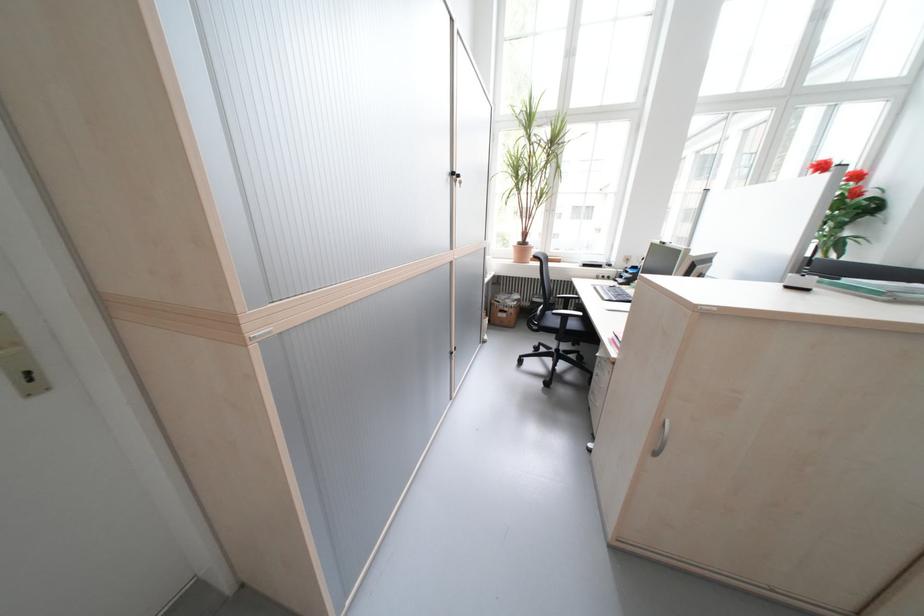
Find the location of `cabinet lock`. cabinet lock is located at coordinates (704, 309).